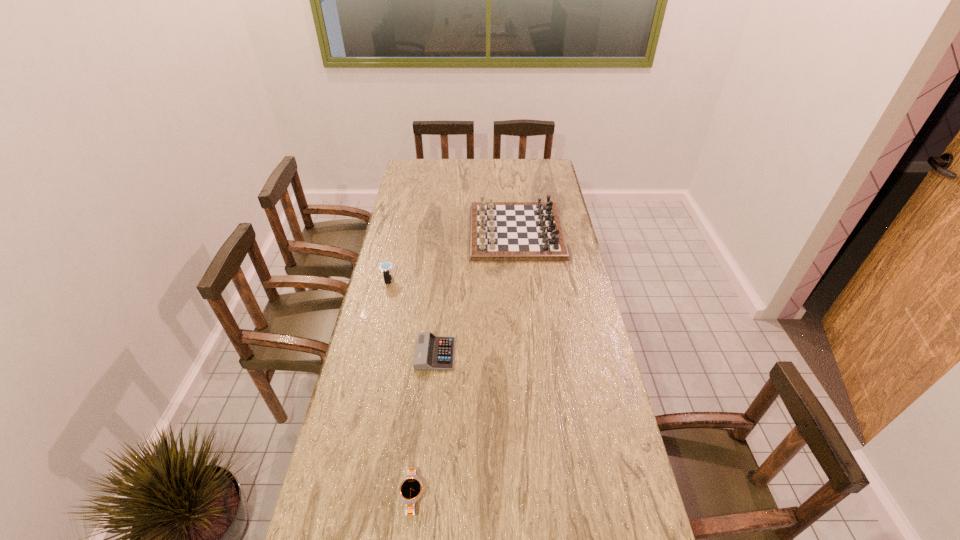
Identify the location of free point located on the front of the taller watch. The height and width of the screenshot is (540, 960). (374, 345).

This screenshot has height=540, width=960. Identify the location of vacant space located on the back of the nearest object. (419, 447).

The image size is (960, 540). I want to click on vacant space situated 0.140m on the back of the third farthest object, so click(440, 308).

What are the coordinates of `object situated at the left edge` in the screenshot? It's located at (385, 268).

Locate an element on the screen. The image size is (960, 540). object positioned at the right edge is located at coordinates (499, 231).

Where is `vacant space at the far edge of the desktop`? This screenshot has width=960, height=540. vacant space at the far edge of the desktop is located at coordinates (473, 163).

Find the location of a particular element. free space at the left edge is located at coordinates (365, 336).

The width and height of the screenshot is (960, 540). I want to click on free space at the right edge of the desktop, so click(594, 386).

The image size is (960, 540). I want to click on vacant region between the shorter watch and the left watch, so click(401, 388).

Find the location of a particular element. This screenshot has width=960, height=540. empty space between the shorter watch and the rightmost object is located at coordinates (465, 363).